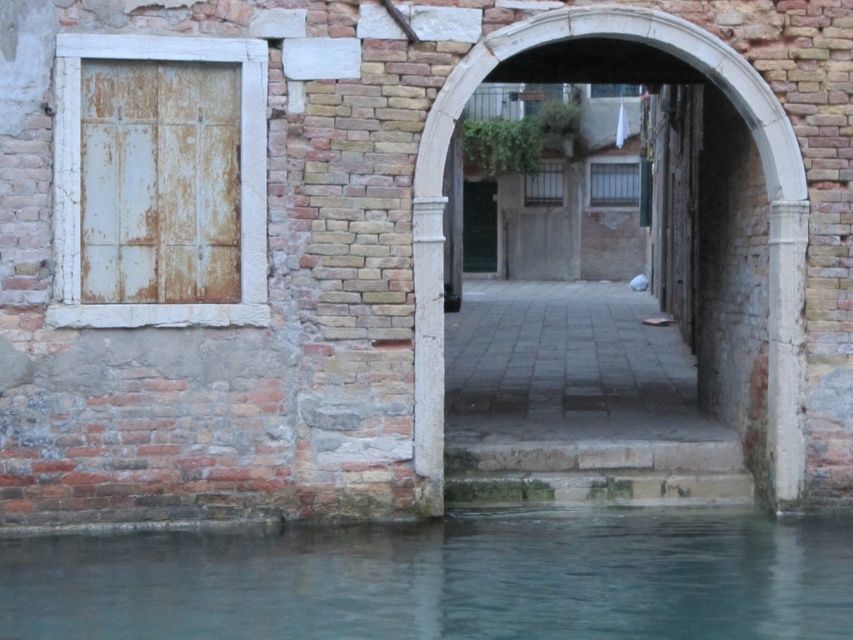
Question: Does clear water at lower center appear on the left side of rusty white door at left?

Choices:
 (A) no
 (B) yes

Answer: (A)

Question: Among these points, which one is nearest to the camera?

Choices:
 (A) (791, 323)
 (B) (343, 548)
 (C) (224, 93)

Answer: (B)

Question: Which point appears farthest from the camera in this image?

Choices:
 (A) coord(10,552)
 (B) coord(802,173)

Answer: (B)

Question: Which of the following is the closest to the observer?

Choices:
 (A) (630, 12)
 (B) (91, 250)
 (C) (653, 586)

Answer: (C)

Question: Does clear water at lower center have a smaller size compared to white stone archway at center?

Choices:
 (A) yes
 (B) no

Answer: (A)

Question: Considering the relative positions of clear water at lower center and white stone archway at center in the image provided, where is clear water at lower center located with respect to white stone archway at center?

Choices:
 (A) below
 (B) above

Answer: (A)